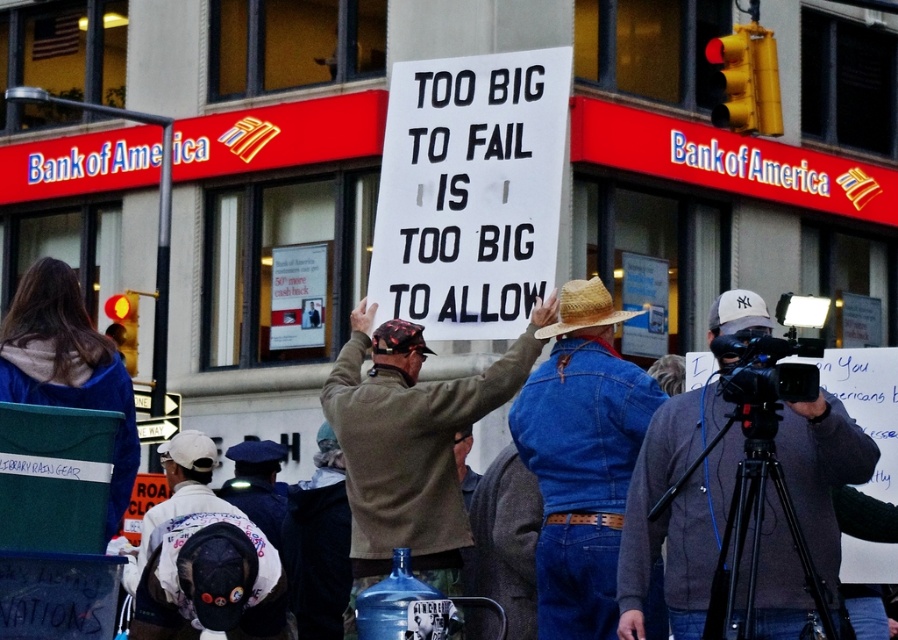
You are a photographer trying to capture the protest scene. You notice the gray fabric jacket at center and the strawhat at center. Which object should you focus on to ensure it fits entirely within your camera frame if your frame can only accommodate the narrower of the two?

The gray fabric jacket at center might be wider than strawhat at center, so to ensure it fits entirely within the camera frame, focus on the strawhat at center since it is narrower.

You are a photographer standing in front of the Bank of America branch. You want to take a photo of the person holding the sign. Which object, the denim jacket at center or the strawhat at center, will appear larger in your photo?

The denim jacket at center will appear larger in the photo because it is closer to the viewer than the strawhat at center.